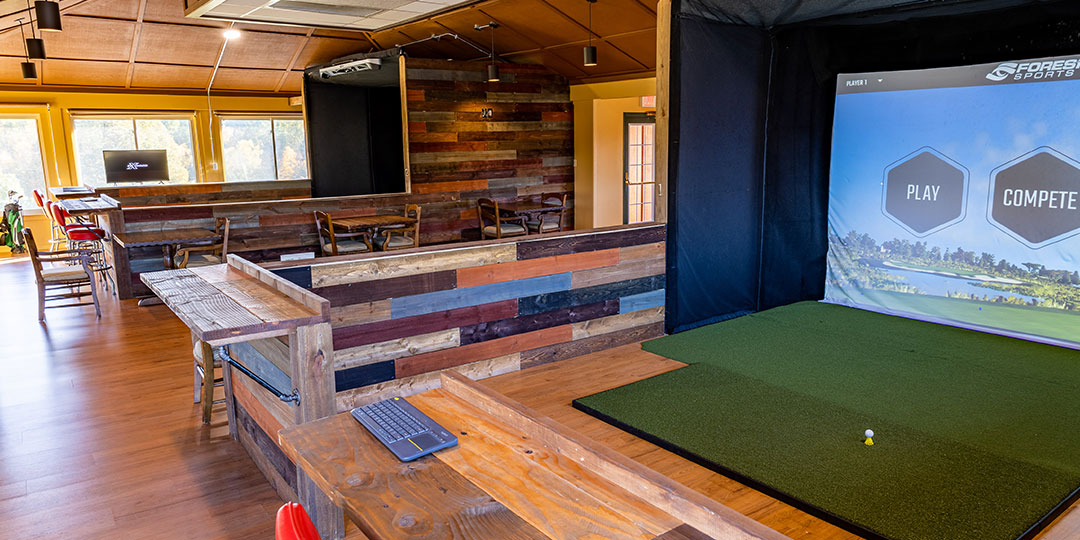
Where is `screen`? The image size is (1080, 540). screen is located at coordinates tap(986, 145).